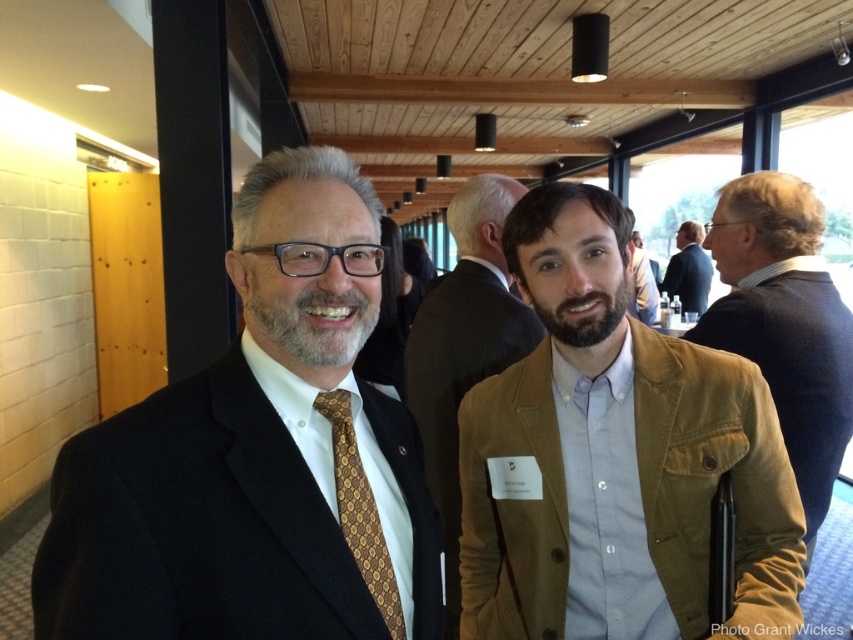
Question: Is matte black suit at left to the right of dark blue suit at center from the viewer's perspective?

Choices:
 (A) no
 (B) yes

Answer: (A)

Question: Can you confirm if matte black suit at left is positioned below dark blue suit at center?

Choices:
 (A) yes
 (B) no

Answer: (A)

Question: Is matte black suit at left to the right of dark blue suit at center from the viewer's perspective?

Choices:
 (A) no
 (B) yes

Answer: (A)

Question: Based on their relative distances, which object is farther from the light brown corduroy blazer at center?

Choices:
 (A) dark blue suit at center
 (B) brown suede jacket at center

Answer: (A)

Question: Among these objects, which one is farthest from the camera?

Choices:
 (A) matte black suit at left
 (B) goldpatterned fabrictie at left
 (C) dark blue suit at center

Answer: (C)

Question: Among these points, which one is farthest from the camera?

Choices:
 (A) (326, 232)
 (B) (357, 536)
 (C) (468, 368)
 (D) (807, 284)

Answer: (C)